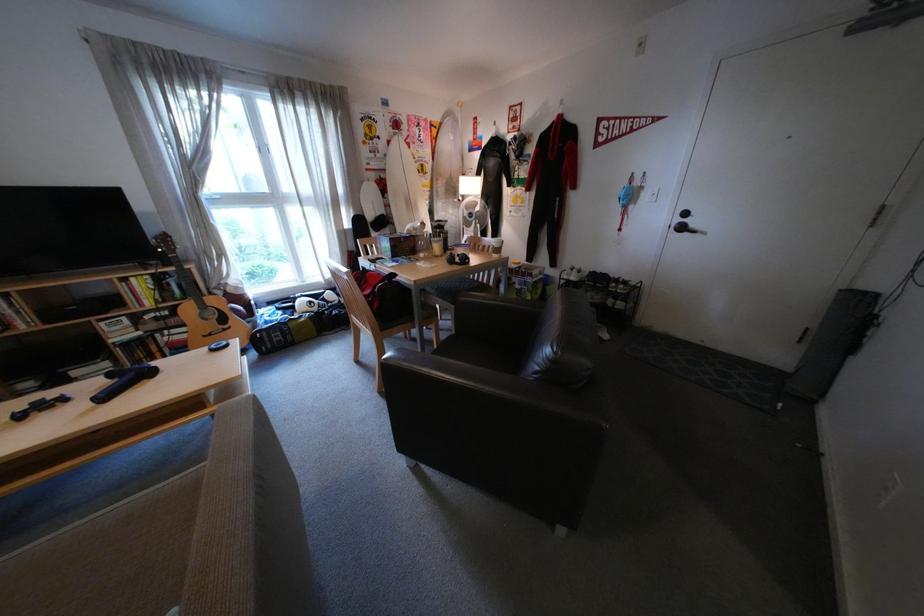
Locate an element on the screen. The width and height of the screenshot is (924, 616). black door handle is located at coordinates (686, 224).